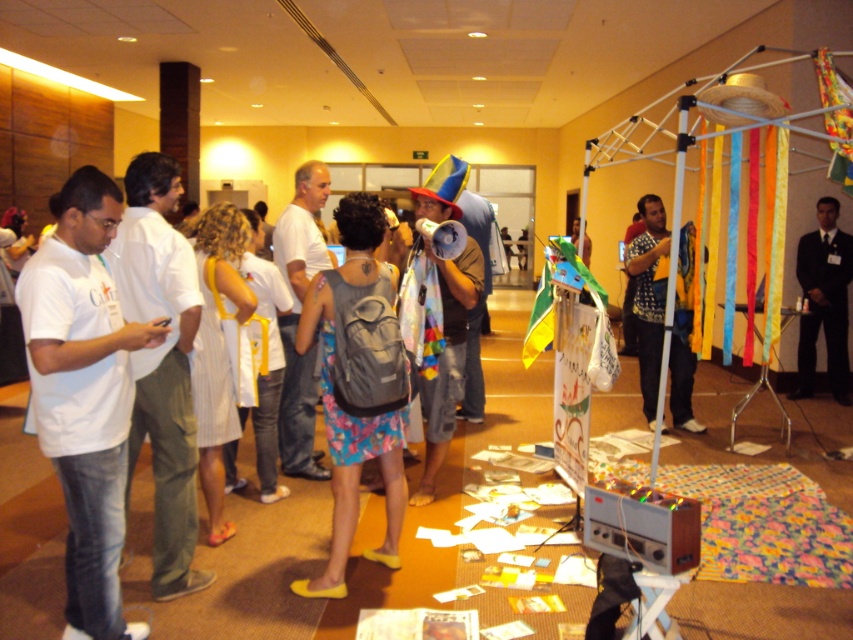
Is gray fabric backpack at center below black suit at right?

Correct, gray fabric backpack at center is located below black suit at right.

Is gray fabric backpack at center to the left of black suit at right from the viewer's perspective?

Indeed, gray fabric backpack at center is positioned on the left side of black suit at right.

Is point (343, 540) positioned in front of point (839, 241)?

Yes.

This screenshot has width=853, height=640. In order to click on gray fabric backpack at center in this screenshot , I will do `click(358, 384)`.

Does black suit at right appear on the left side of patterned fabric at center?

Incorrect, black suit at right is not on the left side of patterned fabric at center.

This screenshot has width=853, height=640. What do you see at coordinates (824, 300) in the screenshot?
I see `black suit at right` at bounding box center [824, 300].

In order to click on black suit at right in this screenshot , I will do `click(824, 300)`.

Identify the location of black suit at right. (824, 300).

Which is behind, point (370, 353) or point (636, 252)?

The point (636, 252) is more distant.

Does gray fabric backpack at center have a lesser width compared to patterned fabric at center?

Correct, gray fabric backpack at center's width is less than patterned fabric at center's.

I want to click on gray fabric backpack at center, so click(x=358, y=384).